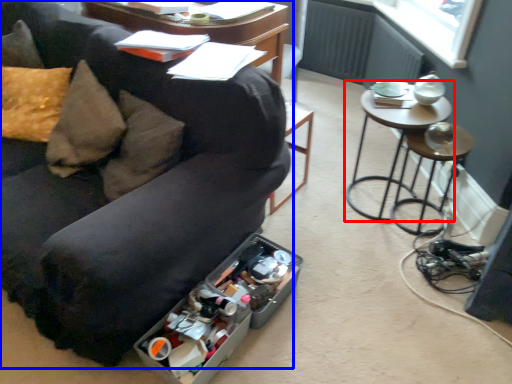
Question: Which point is further to the camera, table (highlighted by a red box) or studio couch (highlighted by a blue box)?

Choices:
 (A) table
 (B) studio couch

Answer: (A)